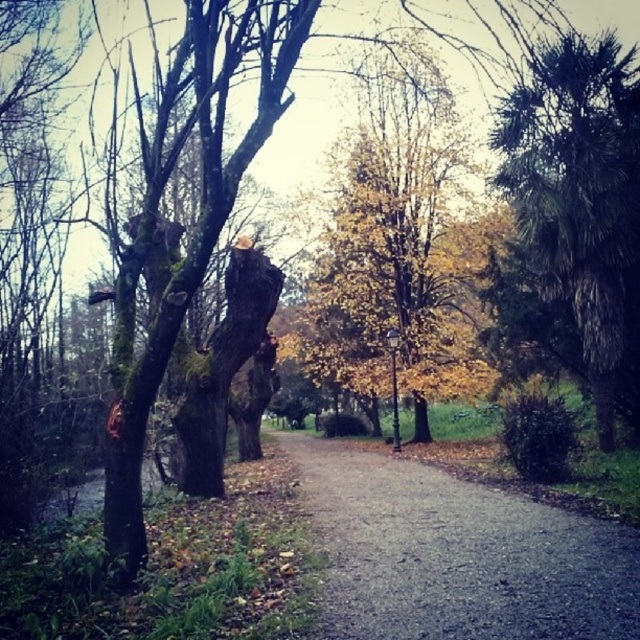
Question: Which of the following is the closest to the observer?

Choices:
 (A) green leafy palm at right
 (B) brown gravel path at center

Answer: (B)

Question: Is brown gravel path at center further to camera compared to yellow leafy tree at center?

Choices:
 (A) yes
 (B) no

Answer: (B)

Question: Which object is farther from the camera taking this photo?

Choices:
 (A) green leafy palm at right
 (B) brown gravel path at center

Answer: (A)

Question: Which point is closer to the camera?

Choices:
 (A) green leafy palm at right
 (B) yellow leafy tree at center

Answer: (A)

Question: Does brown gravel path at center have a lesser width compared to yellow leafy tree at center?

Choices:
 (A) yes
 (B) no

Answer: (B)

Question: From the image, what is the correct spatial relationship of brown gravel path at center in relation to green leafy palm at right?

Choices:
 (A) below
 (B) above

Answer: (A)